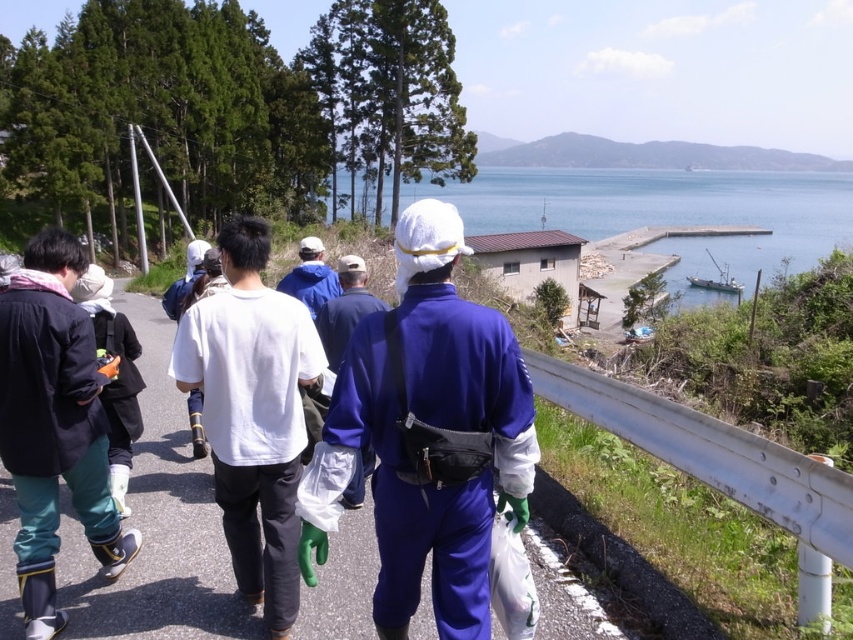
Between blue fabric uniform at center and teal fabric pants at left, which one has more height?

With more height is teal fabric pants at left.

Can you confirm if blue fabric uniform at center is smaller than teal fabric pants at left?

Correct, blue fabric uniform at center occupies less space than teal fabric pants at left.

Does point (511, 493) come behind point (33, 516)?

No, (511, 493) is closer to viewer.

Locate an element on the screen. The height and width of the screenshot is (640, 853). blue fabric uniform at center is located at coordinates click(x=426, y=435).

Consider the image. Is teal fabric pants at left bigger than blue water at center?

No, teal fabric pants at left is not bigger than blue water at center.

Who is positioned more to the right, teal fabric pants at left or blue water at center?

From the viewer's perspective, blue water at center appears more on the right side.

Image resolution: width=853 pixels, height=640 pixels. Describe the element at coordinates (54, 424) in the screenshot. I see `teal fabric pants at left` at that location.

Image resolution: width=853 pixels, height=640 pixels. Find the location of `teal fabric pants at left`. teal fabric pants at left is located at coordinates (54, 424).

Is blue fabric highway at center above blue fabric jacket at center?

No, blue fabric highway at center is not above blue fabric jacket at center.

Is point (213, 508) farther from camera compared to point (322, 264)?

No, it is not.

Locate an element on the screen. blue fabric highway at center is located at coordinates (155, 525).